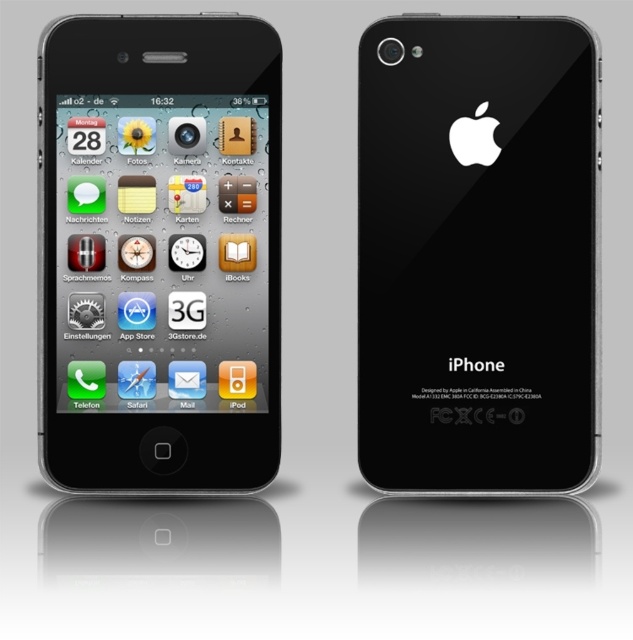
You are holding an iPhone and want to press the power button located at point (99,449) and the volume up button at point (389,392). Which button will you press first if you move your finger straight towards the phone?

You will press the power button located at point (99,449) first because it is closer to your finger than the volume up button at point (389,392).

You are holding two iPhones in your hands. One is the black glossy iPhone at left and the other is the black glossy iPhone at center. Which one do you think is bigger in size?

The black glossy iPhone at left is larger in size compared to the black glossy iPhone at center according to the description.